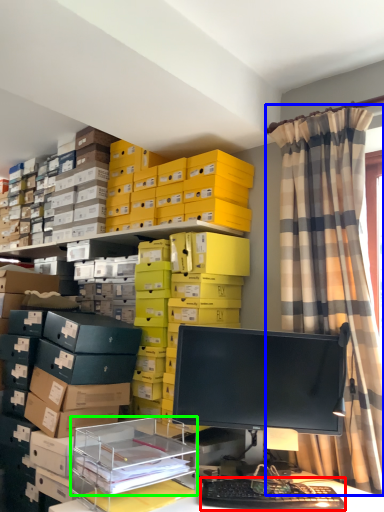
Question: Which object is the farthest from computer keyboard (highlighted by a red box)? Choose among these: curtain (highlighted by a blue box) or shelf (highlighted by a green box).

Choices:
 (A) curtain
 (B) shelf

Answer: (A)